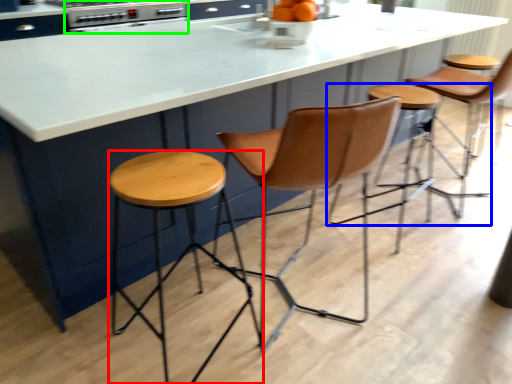
Question: Which object is the closest to the stool (highlighted by a red box)? Choose among these: stool (highlighted by a blue box) or appliance (highlighted by a green box).

Choices:
 (A) stool
 (B) appliance

Answer: (A)